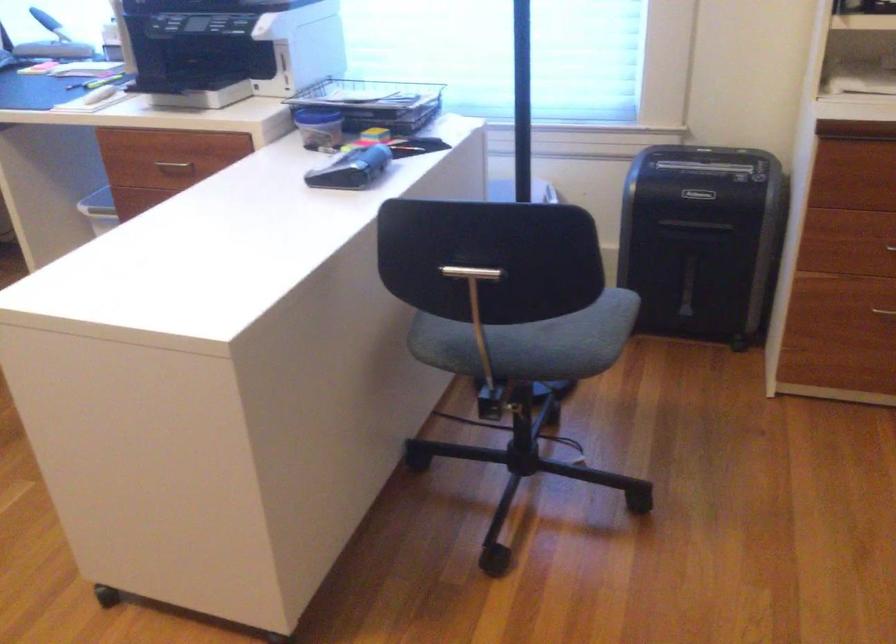
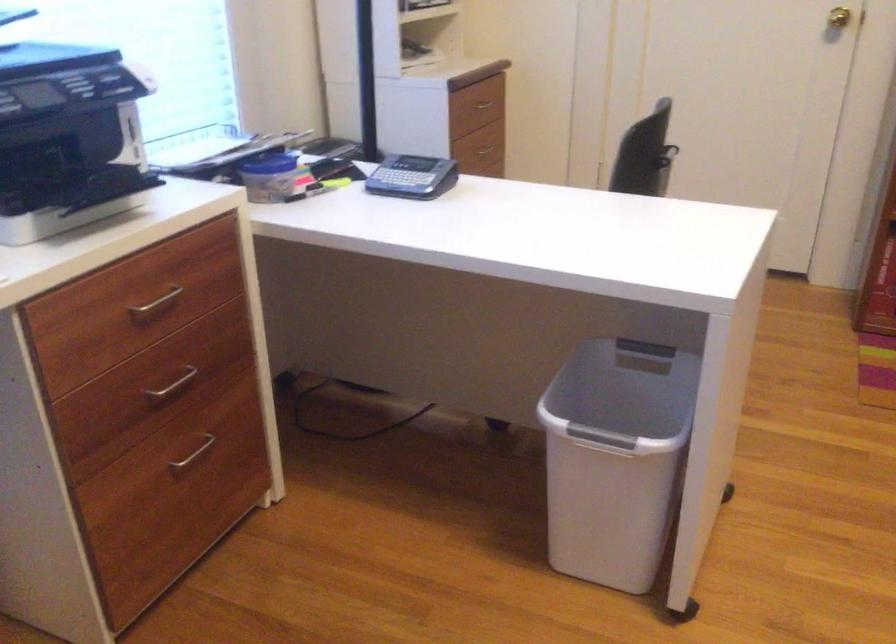
The point at (178, 162) is marked in the first image. Where is the corresponding point in the second image?

(156, 303)